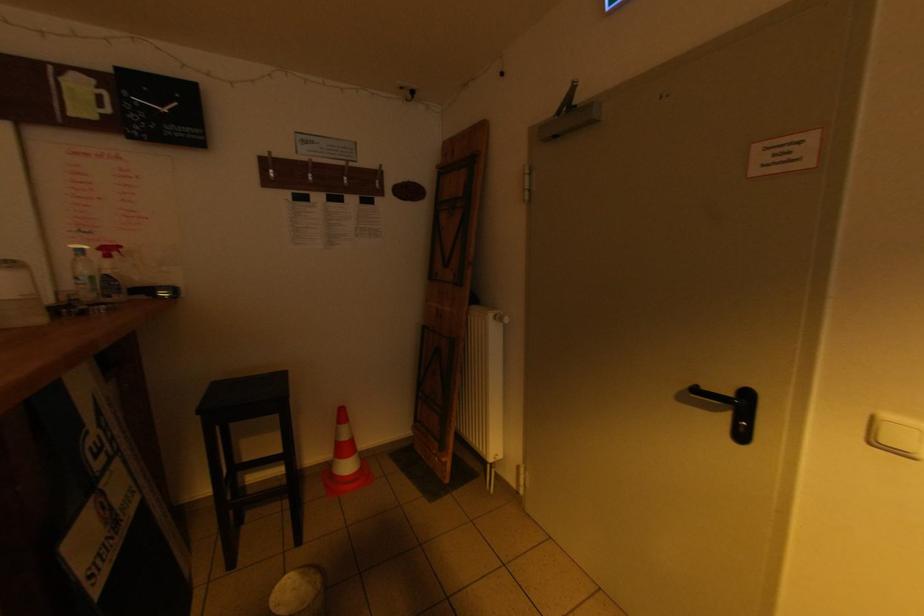
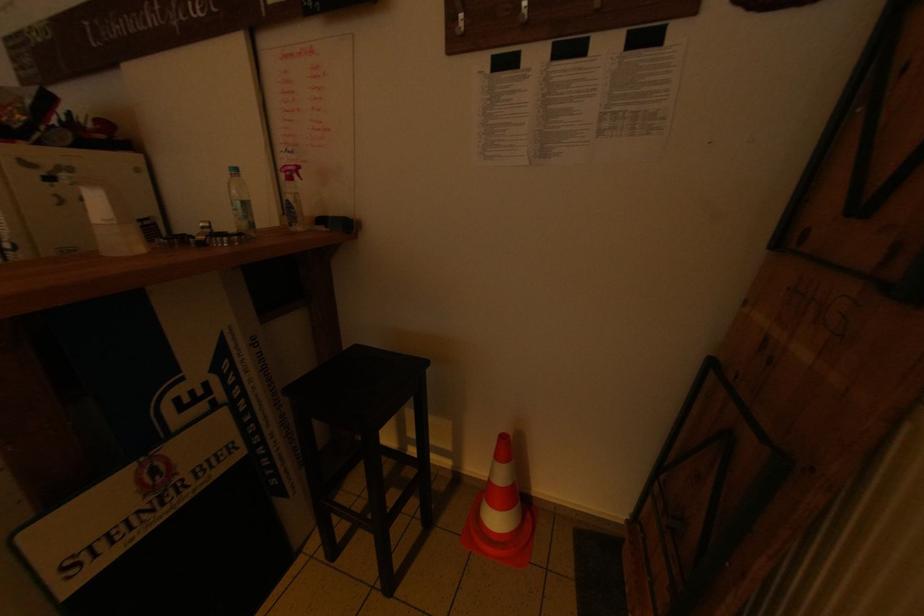
In the second image, find the point that corresponds to (x=116, y=301) in the first image.

(300, 229)